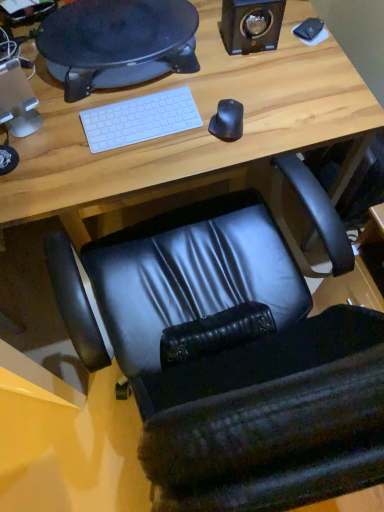
Where is `vacant space situated above matte black desk at upper center (from a real-world perspective)`? vacant space situated above matte black desk at upper center (from a real-world perspective) is located at coordinates (114, 25).